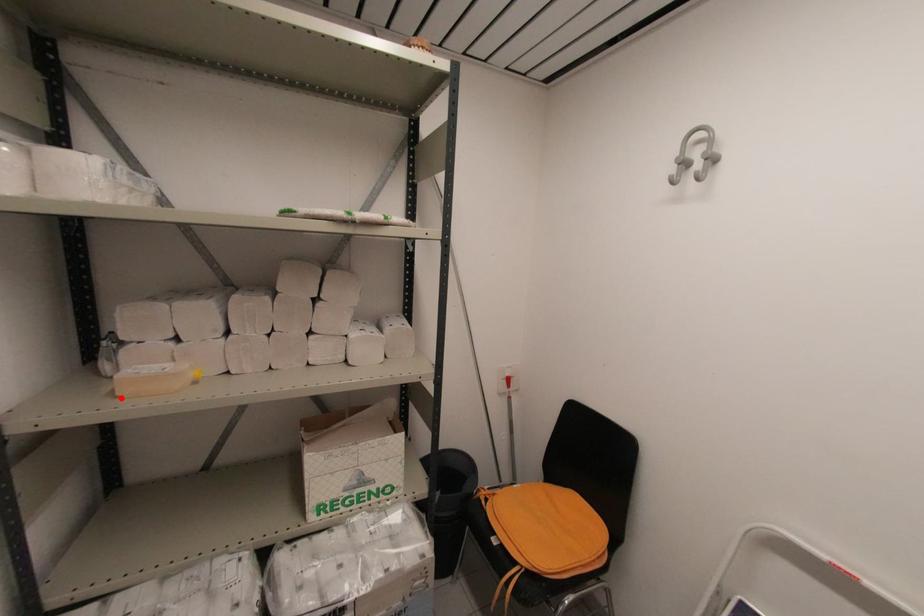
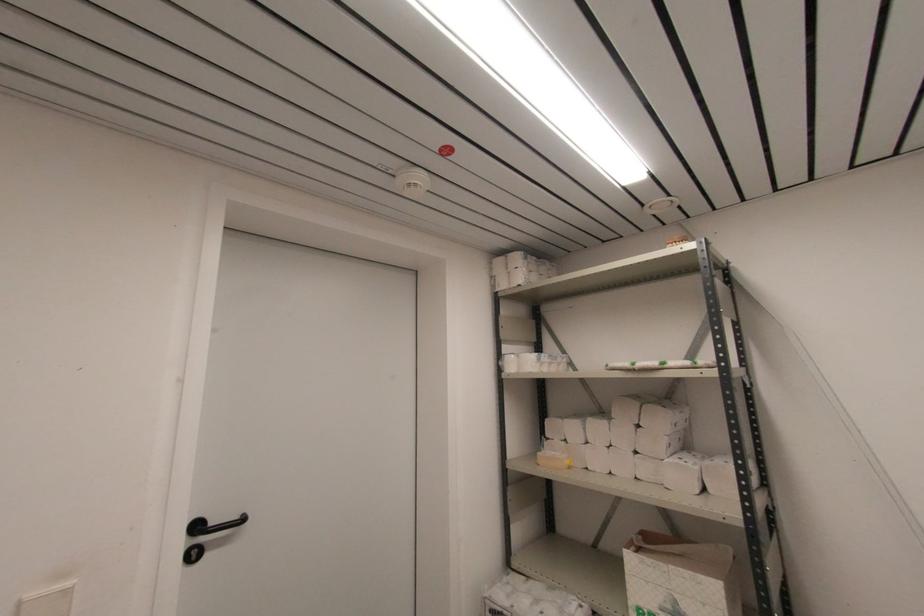
In the second image, find the point that corresponds to the highlighted location in the first image.

(540, 464)